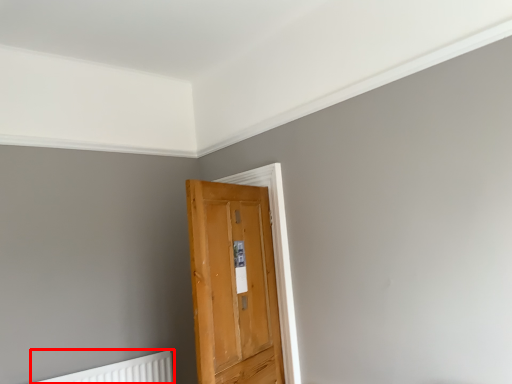
Question: Observing the image, what is the correct spatial positioning of radiator (annotated by the red box) in reference to door?

Choices:
 (A) left
 (B) right

Answer: (A)